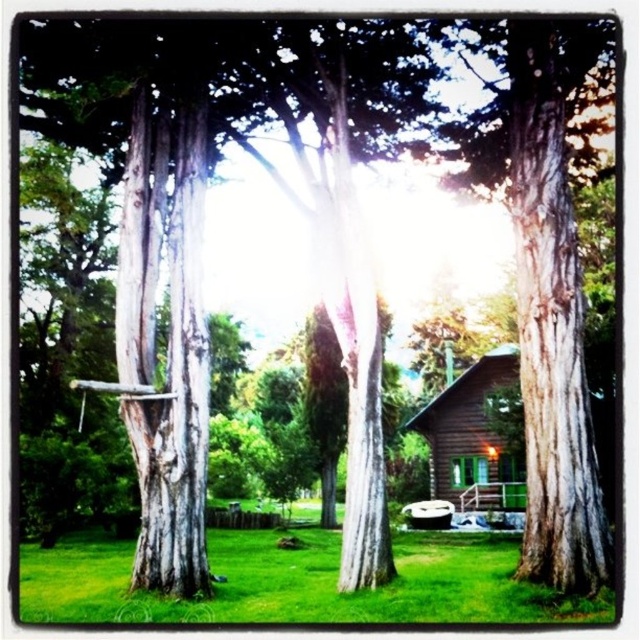
Question: Which is farther from the gray textured tree trunk at left?

Choices:
 (A) green grass at lower center
 (B) brown wooden cabin at center

Answer: (B)

Question: Can you confirm if gray textured tree trunk at left is positioned to the left of brown wooden cabin at center?

Choices:
 (A) yes
 (B) no

Answer: (A)

Question: Is gray textured tree trunk at left further to camera compared to brown wooden cabin at center?

Choices:
 (A) no
 (B) yes

Answer: (A)

Question: Which point appears farthest from the camera in this image?

Choices:
 (A) click(x=376, y=616)
 (B) click(x=433, y=490)
 (C) click(x=205, y=129)

Answer: (B)

Question: Among these objects, which one is farthest from the camera?

Choices:
 (A) brown wooden cabin at center
 (B) green grass at lower center
 (C) gray textured tree trunk at left

Answer: (A)

Question: In this image, where is gray textured tree trunk at left located relative to brown wooden cabin at center?

Choices:
 (A) below
 (B) above

Answer: (B)